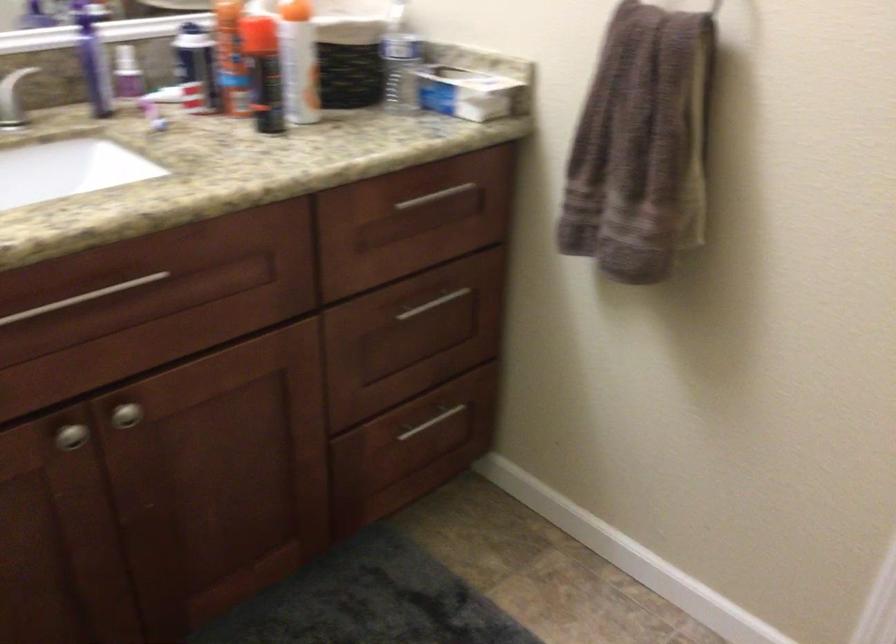
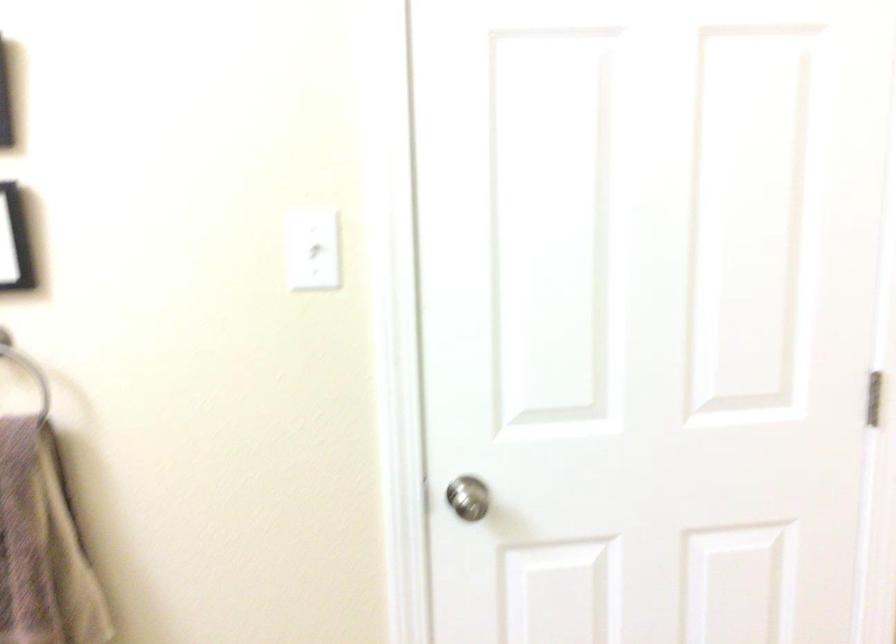
Question: The images are taken continuously from a first-person perspective. In which direction is your viewpoint rotating?

Choices:
 (A) Left
 (B) Right
 (C) Up
 (D) Down

Answer: (B)